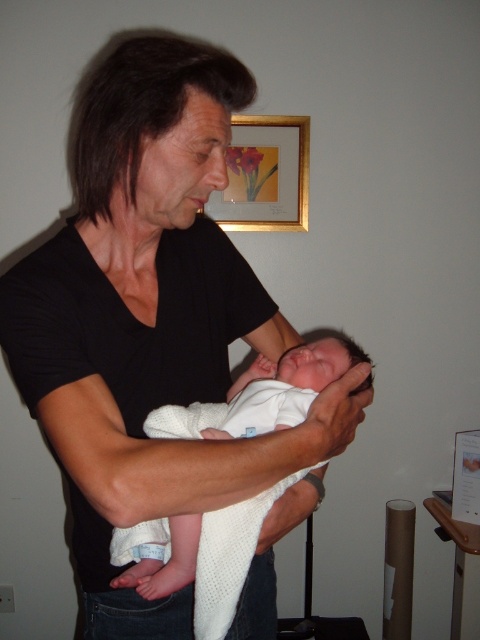
Can you confirm if black matte shirt at center is wider than white knitted cloth at center?

Yes, black matte shirt at center is wider than white knitted cloth at center.

Between point (144, 86) and point (338, 360), which one is positioned behind?

Positioned behind is point (338, 360).

Where is `black matte shirt at center`? The image size is (480, 640). black matte shirt at center is located at coordinates (151, 320).

Does black matte shirt at center come behind gold-framed artwork at upper center?

No, black matte shirt at center is in front of gold-framed artwork at upper center.

Is black matte shirt at center shorter than gold-framed artwork at upper center?

No.

Which is in front, point (90, 352) or point (213, 196)?

Point (90, 352) is more forward.

Where is `black matte shirt at center`? black matte shirt at center is located at coordinates (151, 320).

Does gold-framed artwork at upper center appear on the left side of white knitted cloth at center?

No, gold-framed artwork at upper center is not to the left of white knitted cloth at center.

Is gold-framed artwork at upper center further to camera compared to white knitted cloth at center?

Yes, it is.

Locate an element on the screen. This screenshot has height=640, width=480. gold-framed artwork at upper center is located at coordinates (264, 176).

What are the coordinates of `gold-framed artwork at upper center` in the screenshot? It's located at [x=264, y=176].